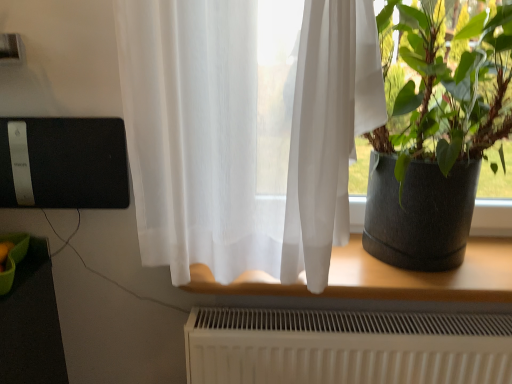
The width and height of the screenshot is (512, 384). What do you see at coordinates (437, 139) in the screenshot?
I see `dark gray textured pot at right` at bounding box center [437, 139].

Find the location of a particular element. The image size is (512, 384). dark gray textured pot at right is located at coordinates (437, 139).

The height and width of the screenshot is (384, 512). What are the coordinates of `translucent fabric at center` in the screenshot? It's located at (385, 277).

Describe the element at coordinates (385, 277) in the screenshot. I see `translucent fabric at center` at that location.

Find the location of `dark gray textured pot at right`. dark gray textured pot at right is located at coordinates (437, 139).

Visually, is dark gray textured pot at right positioned to the left or to the right of translucent fabric at center?

Clearly, dark gray textured pot at right is on the right of translucent fabric at center in the image.

Is dark gray textured pot at right closer to camera compared to translucent fabric at center?

Yes, dark gray textured pot at right is closer to the camera.

Between point (412, 27) and point (411, 300), which one is positioned in front?

Positioned in front is point (412, 27).

From the image's perspective, which one is positioned lower, dark gray textured pot at right or translucent fabric at center?

translucent fabric at center appears lower in the image.

From a real-world perspective, is dark gray textured pot at right over translucent fabric at center?

Correct, in the physical world, dark gray textured pot at right is higher than translucent fabric at center.

Between dark gray textured pot at right and translucent fabric at center, which one has smaller width?

With smaller width is translucent fabric at center.

Is dark gray textured pot at right shorter than translucent fabric at center?

In fact, dark gray textured pot at right may be taller than translucent fabric at center.

Considering the relative sizes of dark gray textured pot at right and translucent fabric at center in the image provided, is dark gray textured pot at right smaller than translucent fabric at center?

Actually, dark gray textured pot at right might be larger than translucent fabric at center.

Based on the photo, would you say dark gray textured pot at right contains translucent fabric at center?

That's incorrect, translucent fabric at center is not inside dark gray textured pot at right.

Is dark gray textured pot at right touching translucent fabric at center?

dark gray textured pot at right is not next to translucent fabric at center, and they're not touching.

Is dark gray textured pot at right oriented towards translucent fabric at center?

No.

The height and width of the screenshot is (384, 512). I want to click on houseplant above the translucent fabric at center (from the image's perspective), so click(437, 139).

In the image, is translucent fabric at center on the left side or the right side of dark gray textured pot at right?

translucent fabric at center is to the left of dark gray textured pot at right.

Is translucent fabric at center further to the viewer compared to dark gray textured pot at right?

Yes, it is.

Which is less distant, [208,275] or [412,125]?

The point [208,275] is closer.

Looking at this image, from the image's perspective, which object appears higher, translucent fabric at center or dark gray textured pot at right?

dark gray textured pot at right, from the image's perspective.

From a real-world perspective, which is physically above, translucent fabric at center or dark gray textured pot at right?

dark gray textured pot at right, from a real-world perspective.

Which object is thinner, translucent fabric at center or dark gray textured pot at right?

translucent fabric at center is thinner.

Can you confirm if translucent fabric at center is taller than dark gray textured pot at right?

No.

Is translucent fabric at center smaller than dark gray textured pot at right?

Correct, translucent fabric at center occupies less space than dark gray textured pot at right.

Would you say translucent fabric at center is outside dark gray textured pot at right?

translucent fabric at center lies outside dark gray textured pot at right's area.

Is translucent fabric at center beside dark gray textured pot at right?

No, translucent fabric at center is not with dark gray textured pot at right.

Does translucent fabric at center turn towards dark gray textured pot at right?

No, translucent fabric at center is not facing towards dark gray textured pot at right.

How many degrees apart are the facing directions of translucent fabric at center and dark gray textured pot at right?

translucent fabric at center and dark gray textured pot at right are facing 1.25 degrees away from each other.

Where is `houseplant in front of the translucent fabric at center`? The width and height of the screenshot is (512, 384). houseplant in front of the translucent fabric at center is located at coordinates (437, 139).

I want to click on houseplant above the translucent fabric at center (from the image's perspective), so click(437, 139).

Identify the location of window lying on the left of dark gray textured pot at right. (385, 277).